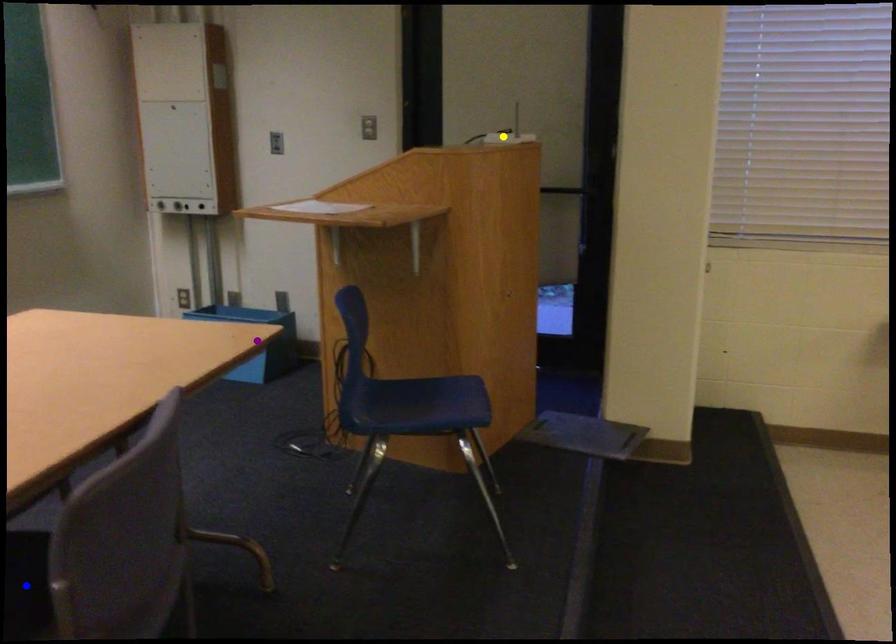
Order these from nearest to farthest:
- purple point
- blue point
- yellow point

blue point < yellow point < purple point